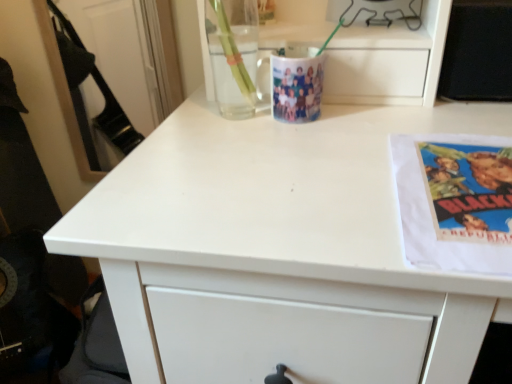
Question: From the image's perspective, is metallic wire at upper center above or below white paper at right?

Choices:
 (A) above
 (B) below

Answer: (A)

Question: Does point (346, 0) appear closer or farther from the camera than point (480, 157)?

Choices:
 (A) closer
 (B) farther

Answer: (B)

Question: Considering the real-world distances, which object is farthest from the metallic wire at upper center?

Choices:
 (A) transparent glass mug at upper center
 (B) white paper at right

Answer: (B)

Question: Estimate the real-world distances between objects in this image. Which object is closer to the metallic wire at upper center?

Choices:
 (A) transparent glass mug at upper center
 (B) white paper at right

Answer: (A)